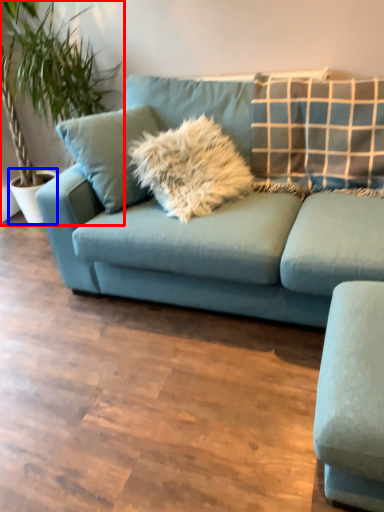
Question: Which point is further to the camera, houseplant (highlighted by a red box) or flowerpot (highlighted by a blue box)?

Choices:
 (A) houseplant
 (B) flowerpot

Answer: (B)